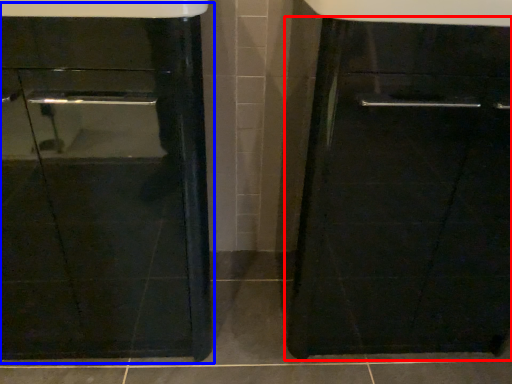
Question: Which of the following is the closest to the observer, cabinetry (highlighted by a red box) or sink (highlighted by a blue box)?

Choices:
 (A) cabinetry
 (B) sink

Answer: (B)